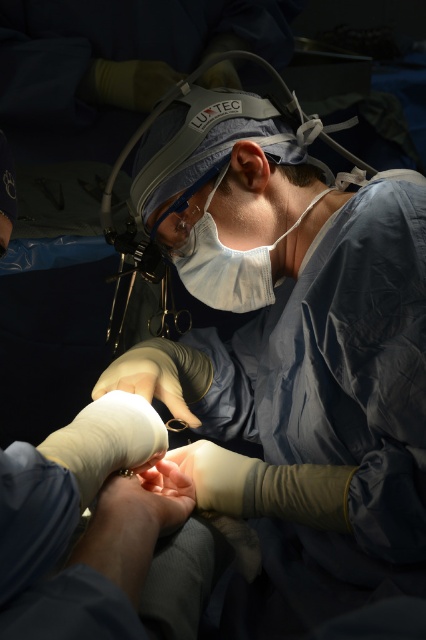
Question: Among these objects, which one is nearest to the camera?

Choices:
 (A) white fabric mask at center
 (B) matte plastic surgical loupes at center

Answer: (B)

Question: Which of the following is the farthest from the observer?

Choices:
 (A) matte plastic surgical loupes at center
 (B) white fabric mask at center

Answer: (B)

Question: In this image, where is white fabric mask at center located relative to matte plastic surgical loupes at center?

Choices:
 (A) above
 (B) below

Answer: (A)

Question: Is white fabric mask at center positioned before matte plastic surgical loupes at center?

Choices:
 (A) yes
 (B) no

Answer: (B)

Question: Does white fabric mask at center appear under matte plastic surgical loupes at center?

Choices:
 (A) yes
 (B) no

Answer: (B)